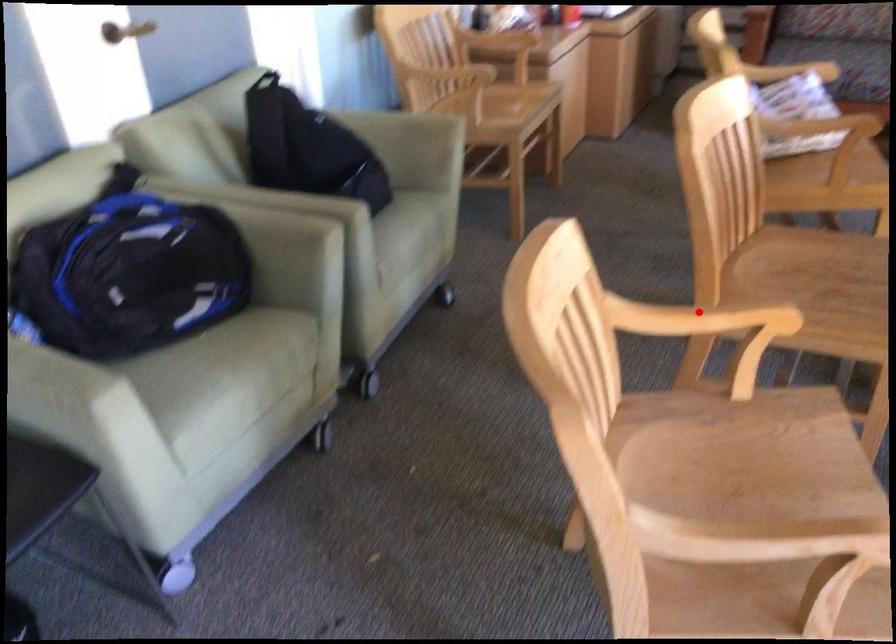
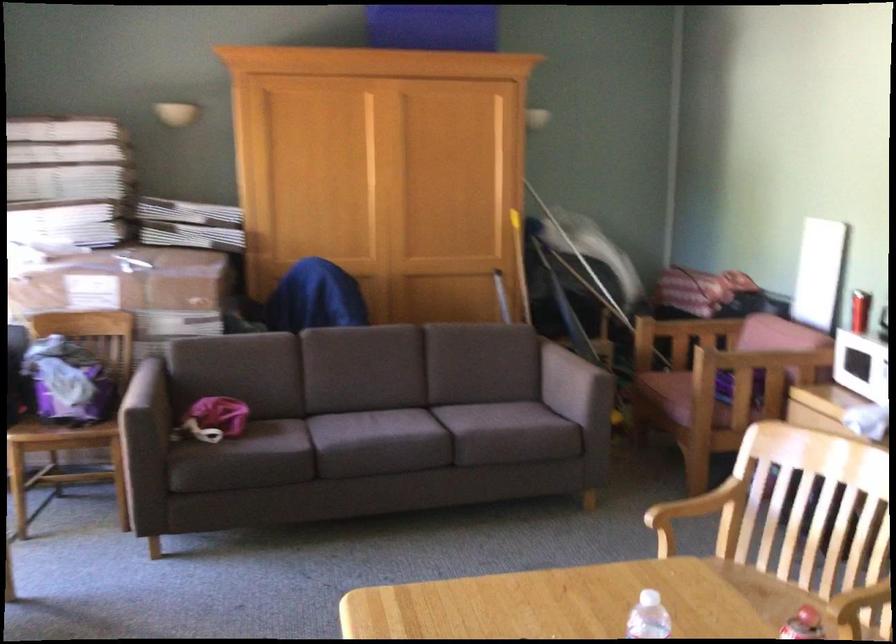
Locate, in the second image, the point that corresponds to the highlighted location in the first image.

(860, 609)